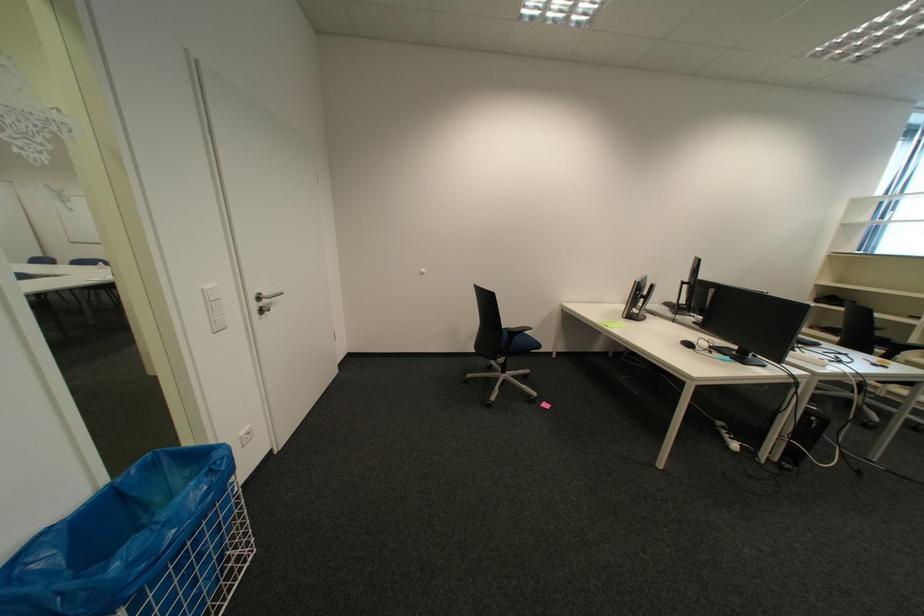
This screenshot has width=924, height=616. What do you see at coordinates (264, 301) in the screenshot?
I see `the metal door handle` at bounding box center [264, 301].